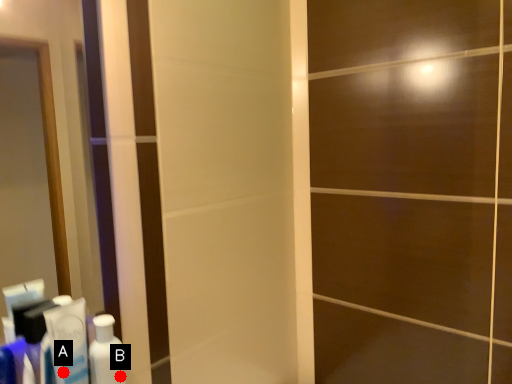
Question: Two points are circled on the image, labeled by A and B beside each circle. Which point is closer to the camera?

Choices:
 (A) A is closer
 (B) B is closer

Answer: (A)